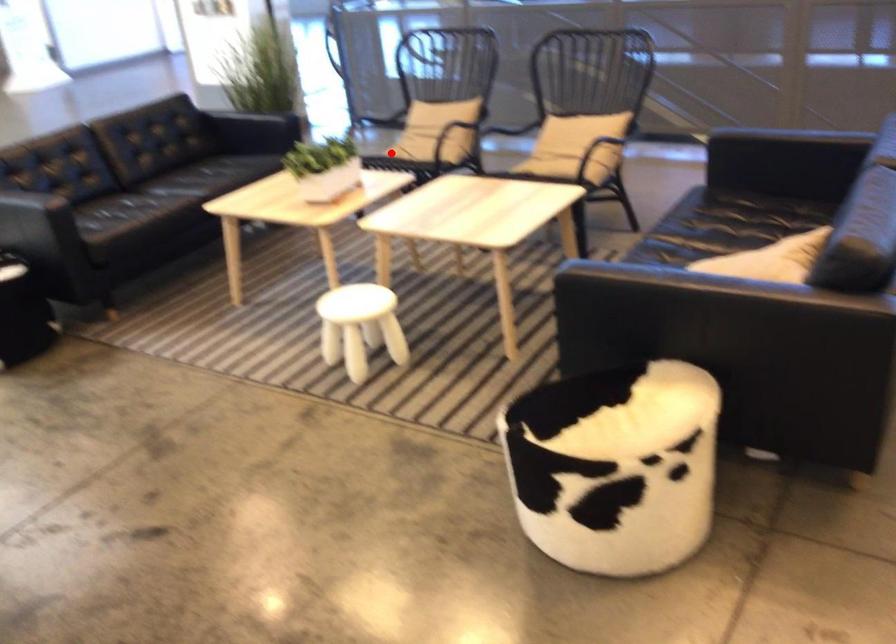
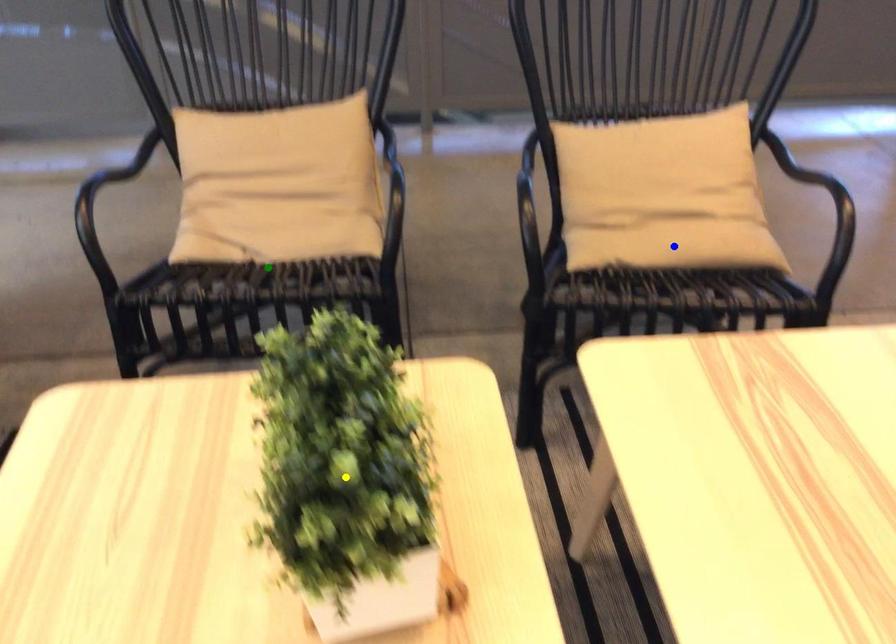
Question: I am providing you with two images of the same scene from different viewpoints. A red point is marked on the first image. You are given multiple points on the second image. Which point in image 2 is actually the same real-world point as the red point in image 1?

Choices:
 (A) blue point
 (B) yellow point
 (C) green point

Answer: (C)